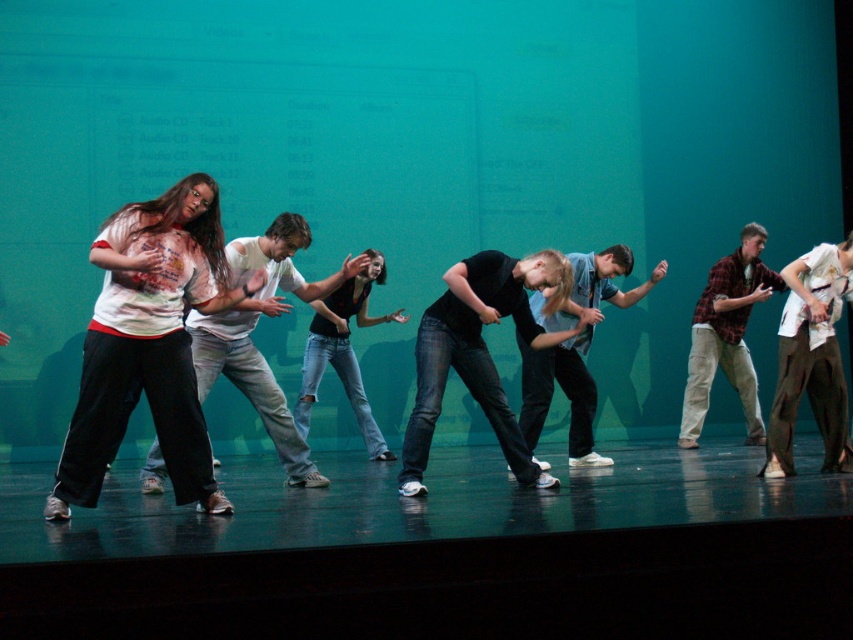
You are a photographer at the back of the stage. You want to take a photo of the matte white shirt at left and the light blue shirt at center so that both are visible in the frame. Based on their positions, which shirt should you focus on first to ensure both are in focus?

The matte white shirt at left is to the left of light blue shirt at center. Since they are positioned side by side, focusing on the light blue shirt at center would help ensure both are in focus as it is centrally located between the two.

You are a photographer capturing the dance performance. You need to ensure the matte white shirt at left and plaid flannel shirt at center are both visible in your shot. Based on their positions, which shirt should you focus on first to capture both in the frame?

The matte white shirt at left is to the left of the plaid flannel shirt at center. To capture both in the frame, focus on the matte white shirt at left first since it is positioned further left, allowing the plaid flannel shirt at center to be included in the shot as well.